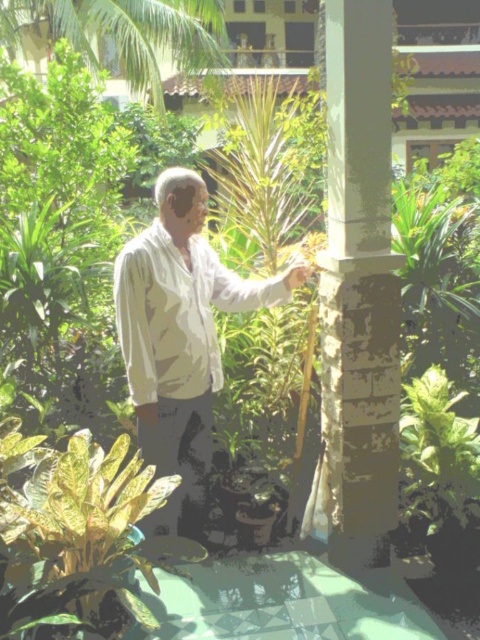
Question: Does white matte shirt at center come behind white cotton shirt at center?

Choices:
 (A) no
 (B) yes

Answer: (B)

Question: Which object appears farthest from the camera in this image?

Choices:
 (A) white matte shirt at center
 (B) white textured pillar at center
 (C) white cotton shirt at center
 (D) green leafy palm tree at upper left

Answer: (D)

Question: Is white matte shirt at center positioned at the back of green leafy palm tree at upper left?

Choices:
 (A) no
 (B) yes

Answer: (A)

Question: Does white matte shirt at center have a lesser width compared to green leafy palm tree at upper left?

Choices:
 (A) yes
 (B) no

Answer: (A)

Question: Considering the real-world distances, which object is farthest from the white textured pillar at center?

Choices:
 (A) green leafy palm tree at upper left
 (B) white cotton shirt at center

Answer: (A)

Question: Which point appears farthest from the camera in this image?

Choices:
 (A) (360, 163)
 (B) (195, 371)
 (C) (156, 102)

Answer: (C)